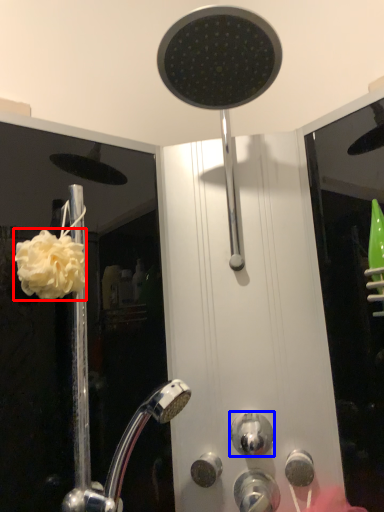
Question: Which object is further to the camera taking this photo, flower (highlighted by a red box) or knob (highlighted by a blue box)?

Choices:
 (A) flower
 (B) knob

Answer: (B)